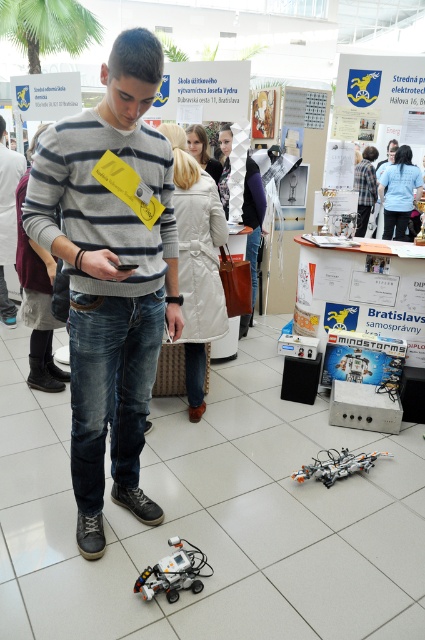
You are standing at the point labeled as point (326,451) and want to walk towards the LEGO Mindstorms kits displayed at point labeled as point (198,561). Is the direction you need to walk towards the LEGO Mindstorms kits located in front of you?

Yes, the point labeled as point (198,561) is in front of point labeled as point (326,451), so walking towards it would be moving forward.

You are a visitor at the exhibition and want to take a photo of both the white plastic robot at lower center and the orange metallic robot at lower center in the same frame. The camera you have can capture a maximum width of 36 inches. Can you fit both robots in the frame without moving either the camera or the robots?

The white plastic robot at lower center and orange metallic robot at lower center are 35.53 inches apart from each other. Since the distance between them is less than the camera maximum width of 36 inches, you can fit both robots in the frame without moving either the camera or the robots.